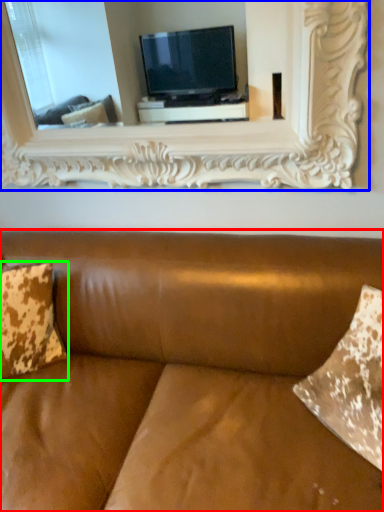
Question: Estimate the real-world distances between objects in this image. Which object is farther from studio couch (highlighted by a red box), picture frame (highlighted by a blue box) or pillow (highlighted by a green box)?

Choices:
 (A) picture frame
 (B) pillow

Answer: (A)